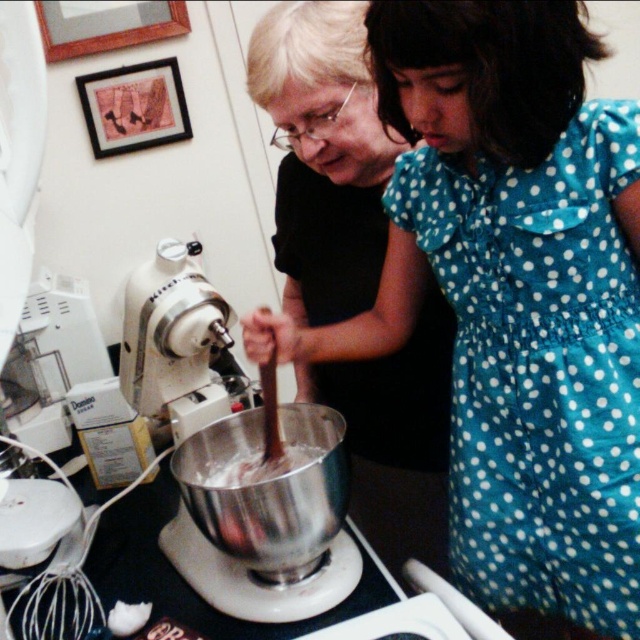
Is point (557, 74) in front of point (179, 272)?

Yes, point (557, 74) is closer to viewer.

Between point (570, 298) and point (214, 289), which one is positioned in front?

Positioned in front is point (570, 298).

Find the location of a particular element. black matte stand mixer at center is located at coordinates 513,294.

Between point (500, 381) and point (291, 10), which one is positioned behind?

The point (291, 10) is behind.

Which is in front, point (400, 125) or point (356, 109)?

Point (400, 125) is in front.

This screenshot has height=640, width=640. In order to click on black matte stand mixer at center in this screenshot , I will do `click(513, 294)`.

Is matte black stand mixer at center bigger than smooth chocolate batter at center?

Yes.

Does matte black stand mixer at center have a smaller size compared to smooth chocolate batter at center?

Incorrect, matte black stand mixer at center is not smaller in size than smooth chocolate batter at center.

Identify the location of matte black stand mixer at center. The image size is (640, 640). 323,157.